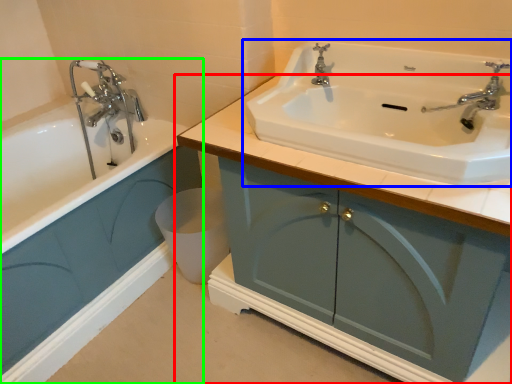
Question: Which is farther away from bathroom cabinet (highlighted by a red box)? sink (highlighted by a blue box) or bathroom cabinet (highlighted by a green box)?

Choices:
 (A) sink
 (B) bathroom cabinet

Answer: (B)